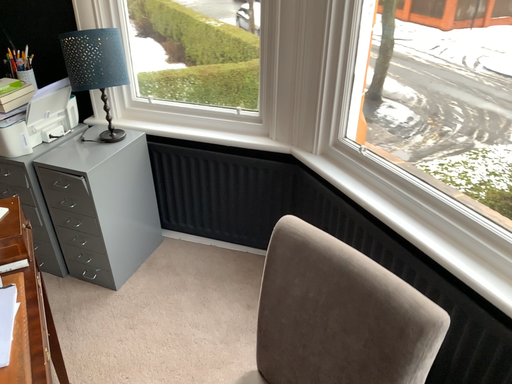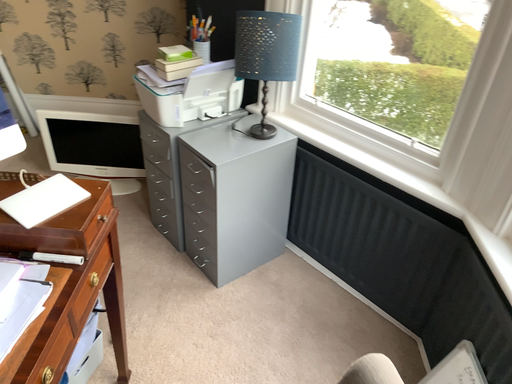
Question: Which way did the camera rotate in the video?

Choices:
 (A) rotated right
 (B) rotated left

Answer: (B)